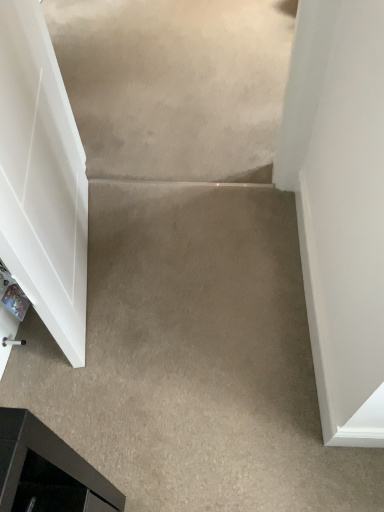
The height and width of the screenshot is (512, 384). Describe the element at coordinates (42, 179) in the screenshot. I see `white glossy door at left` at that location.

What is the approximate width of white glossy door at left?

white glossy door at left is 2.88 inches in width.

Image resolution: width=384 pixels, height=512 pixels. What are the coordinates of `white glossy door at left` in the screenshot? It's located at (42, 179).

At what (x,y) coordinates should I click in order to perform the action: click on white glossy door at left. Please return your answer as a coordinate pair (x, y). This screenshot has width=384, height=512. Looking at the image, I should click on (42, 179).